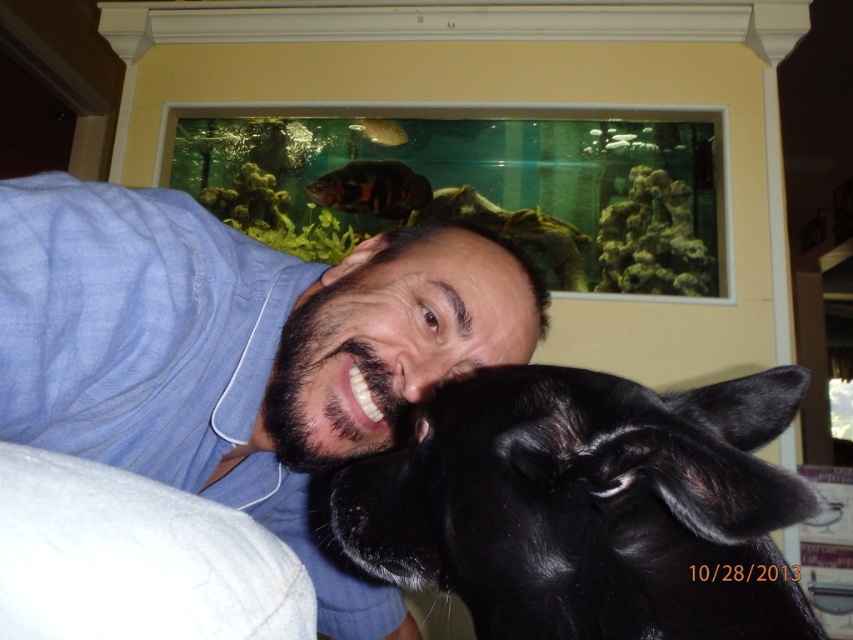
Question: Can you confirm if blue cotton shirt at center is smaller than shiny black fish at upper center?

Choices:
 (A) yes
 (B) no

Answer: (B)

Question: Does black shiny fur at center lie in front of shiny black fish at upper center?

Choices:
 (A) yes
 (B) no

Answer: (A)

Question: Does blue cotton shirt at center have a greater width compared to black shiny fur at center?

Choices:
 (A) no
 (B) yes

Answer: (B)

Question: Which is nearer to the blue cotton shirt at center?

Choices:
 (A) black shiny fur at center
 (B) shiny black fish at upper center

Answer: (A)

Question: Which point is closer to the camera taking this photo?

Choices:
 (A) (332, 176)
 (B) (755, 541)

Answer: (B)

Question: Which of the following is the farthest from the observer?

Choices:
 (A) shiny black fish at upper center
 (B) black shiny fur at center

Answer: (A)